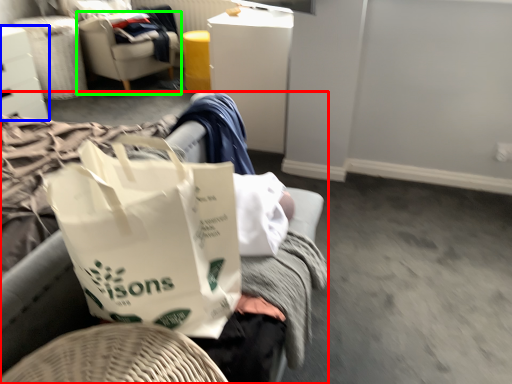
Question: Which is nearer to the furniture (highlighted by a red box)? furniture (highlighted by a blue box) or chair (highlighted by a green box).

Choices:
 (A) furniture
 (B) chair

Answer: (A)